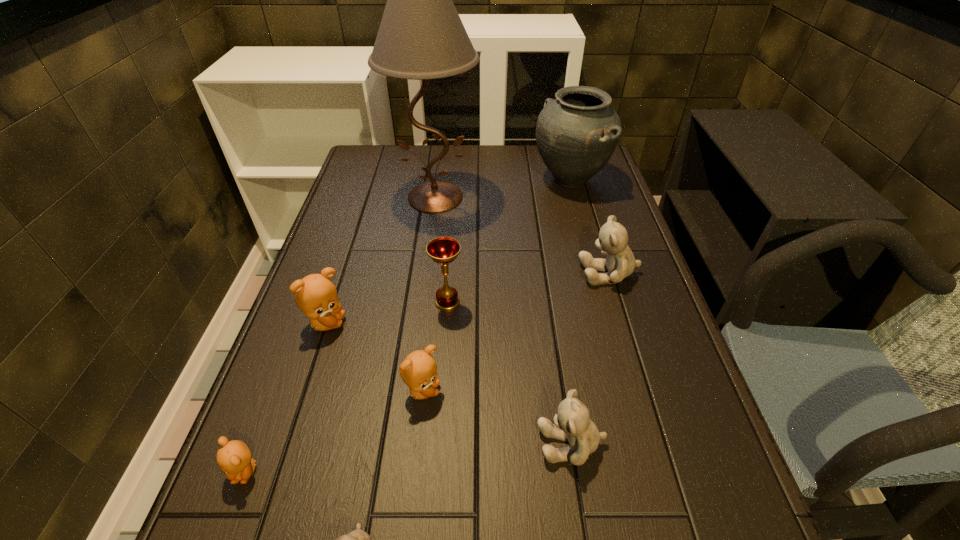
The image size is (960, 540). I want to click on the sixth closest object relative to the table lamp, so click(x=572, y=423).

The height and width of the screenshot is (540, 960). Find the location of `the third closest object to the smallest brown teddy bear`. the third closest object to the smallest brown teddy bear is located at coordinates (316, 296).

Choose which teddy bear is the fifth nearest neighbor to the smallest gray teddy bear. Please provide its 2D coordinates. Your answer should be formatted as a tuple, i.e. [(x, y)], where the tuple contains the x and y coordinates of a point satisfying the conditions above.

[(620, 262)]

Find the location of a particular element. Image resolution: width=960 pixels, height=540 pixels. teddy bear that stands as the third closest to the second gray teddy bear from left to right is located at coordinates (620, 262).

Select which brown teddy bear is the second closest to the second smallest gray teddy bear. Please provide its 2D coordinates. Your answer should be formatted as a tuple, i.e. [(x, y)], where the tuple contains the x and y coordinates of a point satisfying the conditions above.

[(316, 296)]

I want to click on brown teddy bear that stands as the second closest to the urn, so click(x=418, y=370).

The height and width of the screenshot is (540, 960). I want to click on gray teddy bear that stands as the closest to the fifth nearest teddy bear, so click(358, 539).

Identify which gray teddy bear is the nearest to the rightmost teddy bear. Please provide its 2D coordinates. Your answer should be formatted as a tuple, i.e. [(x, y)], where the tuple contains the x and y coordinates of a point satisfying the conditions above.

[(572, 423)]

I want to click on free location that satisfies the following two spatial constraints: 1. on the face of the rightmost gray teddy bear; 2. on the face of the nearest brown teddy bear, so point(669,471).

Where is `vacant area that satisfies the following two spatial constraints: 1. on the face of the second farthest gray teddy bear; 2. on the face of the smallest brown teddy bear`? This screenshot has width=960, height=540. vacant area that satisfies the following two spatial constraints: 1. on the face of the second farthest gray teddy bear; 2. on the face of the smallest brown teddy bear is located at coordinates (575, 471).